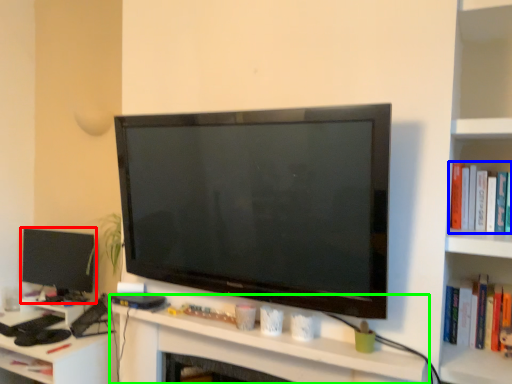
Question: Which object is the farthest from television (highlighted by a red box)? Choose among these: book (highlighted by a blue box) or computer (highlighted by a green box).

Choices:
 (A) book
 (B) computer

Answer: (A)